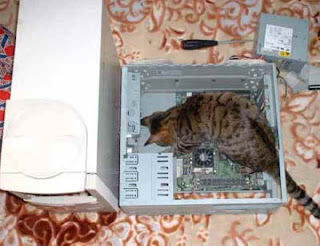
Identify the location of table. The image size is (320, 246). (186, 229).